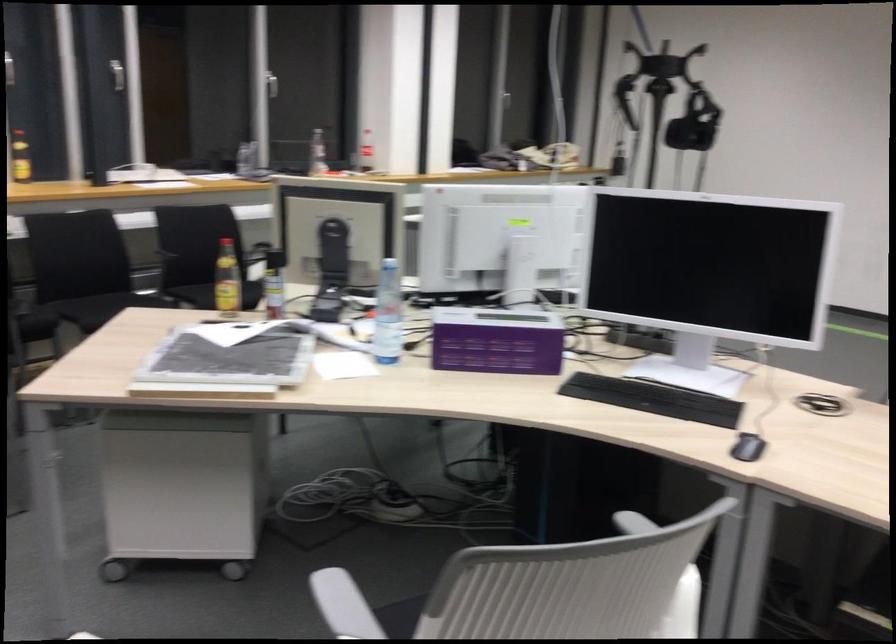
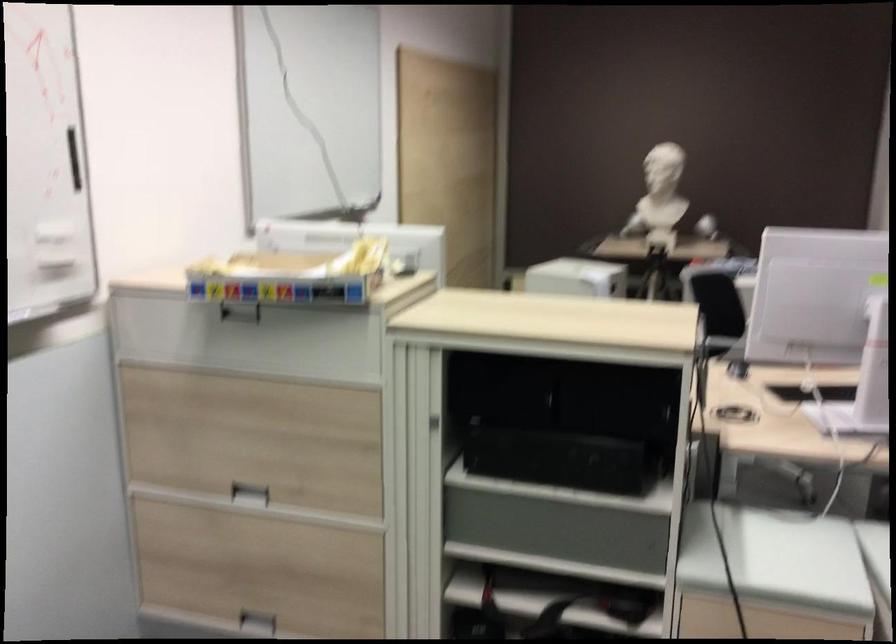
Question: I am providing you with two images of the same scene from different viewpoints. Please identify which objects are invisible in image2.

Choices:
 (A) metallic door handle
 (B) recessed drawer handle
 (C) black box handle
 (D) white chair armrest

Answer: (D)